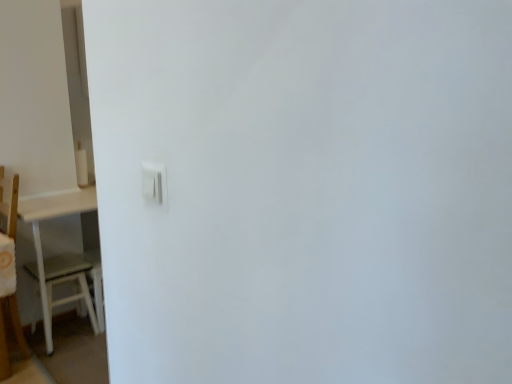
Describe the element at coordinates (50, 218) in the screenshot. The width and height of the screenshot is (512, 384). I see `white matte table at left` at that location.

Where is `white wooden table at left`? white wooden table at left is located at coordinates (14, 335).

This screenshot has width=512, height=384. Identify the location of white plastic light switch at center. (154, 184).

At what (x,y) coordinates should I click in order to perform the action: click on light switch lying above the white wooden table at left (from the image's perspective). Please return your answer as a coordinate pair (x, y). Looking at the image, I should click on (154, 184).

Would you say white wooden table at left is a long distance from white plastic light switch at center?

Absolutely, white wooden table at left is distant from white plastic light switch at center.

Is white wooden table at left bigger or smaller than white plastic light switch at center?

Considering their sizes, white wooden table at left takes up more space than white plastic light switch at center.

Can you tell me how much white matte table at left and white plastic light switch at center differ in facing direction?

white matte table at left and white plastic light switch at center are facing 87.4 degrees away from each other.

In the scene shown: Is white plastic light switch at center completely or partially inside white matte table at left?

Definitely not — white plastic light switch at center is not inside white matte table at left.

Between white matte table at left and white plastic light switch at center, which one is positioned in front?

white plastic light switch at center is in front.

From the image's perspective, which is below, white matte table at left or white plastic light switch at center?

white matte table at left, from the image's perspective.

Is the position of white plastic light switch at center more distant than that of white wooden table at left?

That is False.

Measure the distance between white plastic light switch at center and white wooden table at left.

white plastic light switch at center and white wooden table at left are 1.60 meters apart.

Which object is positioned more to the right, white plastic light switch at center or white wooden table at left?

white plastic light switch at center.

Which of these two, white plastic light switch at center or white wooden table at left, is wider?

white wooden table at left.

In terms of size, does white plastic light switch at center appear bigger or smaller than white matte table at left?

Clearly, white plastic light switch at center is smaller in size than white matte table at left.

Could you tell me if white plastic light switch at center is turned towards white matte table at left?

No, white plastic light switch at center is not oriented towards white matte table at left.

Is white plastic light switch at center closer to the viewer compared to white matte table at left?

That is True.

From the picture: Does white plastic light switch at center touch white matte table at left?

white plastic light switch at center is not next to white matte table at left, and they're not touching.

Considering the positions of objects white matte table at left and white wooden table at left in the image provided, who is more to the left, white matte table at left or white wooden table at left?

white wooden table at left.

Considering the relative sizes of white matte table at left and white wooden table at left in the image provided, is white matte table at left shorter than white wooden table at left?

Indeed, white matte table at left has a lesser height compared to white wooden table at left.

Is white matte table at left spatially inside white wooden table at left, or outside of it?

white matte table at left is located beyond the bounds of white wooden table at left.

Is white matte table at left positioned before white wooden table at left?

No, it is not.

From the image's perspective, is white wooden table at left located above or below white matte table at left?

Clearly, from the image's perspective, white wooden table at left is above white matte table at left.

Is white wooden table at left not near white matte table at left?

No, white wooden table at left is in close proximity to white matte table at left.

Considering the relative positions of white wooden table at left and white matte table at left in the image provided, is white wooden table at left behind white matte table at left?

No, white wooden table at left is in front of white matte table at left.

Does white wooden table at left turn towards white matte table at left?

Yes, white wooden table at left is turned towards white matte table at left.

The image size is (512, 384). I want to click on furniture lying behind the white plastic light switch at center, so click(x=14, y=335).

In order to click on light switch on the right side of white matte table at left in this screenshot , I will do `click(154, 184)`.

Based on their spatial positions, is white plastic light switch at center or white wooden table at left closer to white matte table at left?

white wooden table at left.

Considering their positions, is white plastic light switch at center positioned closer to white wooden table at left than white matte table at left?

white matte table at left.

From the image, which object appears to be nearer to white matte table at left, white wooden table at left or white plastic light switch at center?

white wooden table at left.

Based on the photo, based on their spatial positions, is white matte table at left or white wooden table at left further from white plastic light switch at center?

white matte table at left is positioned further to the anchor white plastic light switch at center.

From the image, which object appears to be farther from white wooden table at left, white matte table at left or white plastic light switch at center?

The object further to white wooden table at left is white plastic light switch at center.

Based on their spatial positions, is white wooden table at left or white matte table at left further from white plastic light switch at center?

white matte table at left.

I want to click on table situated between white wooden table at left and white plastic light switch at center from left to right, so click(50, 218).